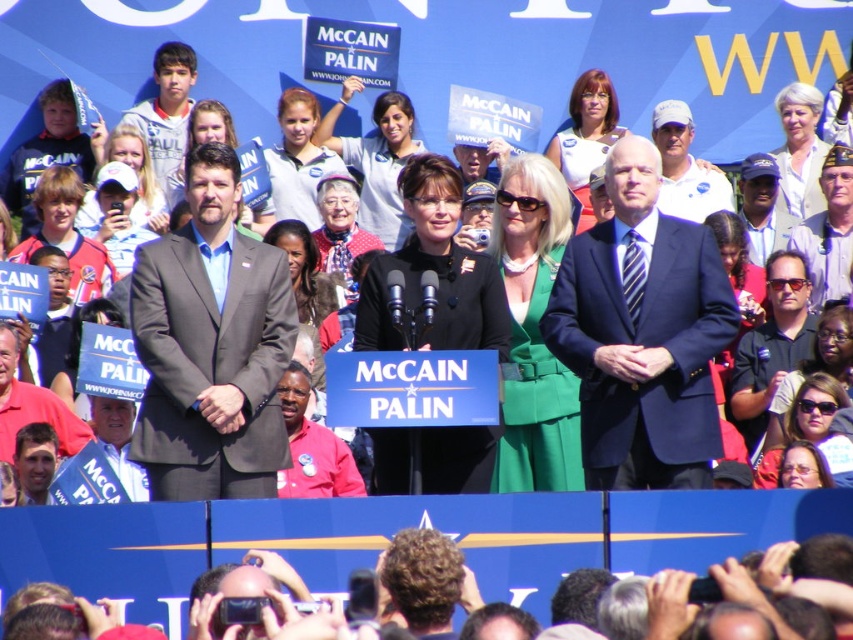
Question: Does black shirt at center have a lesser width compared to khaki uniform at center?

Choices:
 (A) no
 (B) yes

Answer: (A)

Question: Which point is farther from the camera taking this photo?

Choices:
 (A) (809, 259)
 (B) (233, 189)
 (C) (519, 113)

Answer: (C)

Question: Which point appears closest to the camera in this image?

Choices:
 (A) (825, 289)
 (B) (607, 362)
 (C) (123, 467)
 (D) (347, 97)

Answer: (B)

Question: Is khaki uniform at center thinner than white plastic sign at center?

Choices:
 (A) yes
 (B) no

Answer: (A)

Question: Which point is farther from the camera taking this photo?

Choices:
 (A) (604, 156)
 (B) (136, 289)

Answer: (A)

Question: Is dark blue suit at center thinner than khaki uniform at center?

Choices:
 (A) yes
 (B) no

Answer: (B)